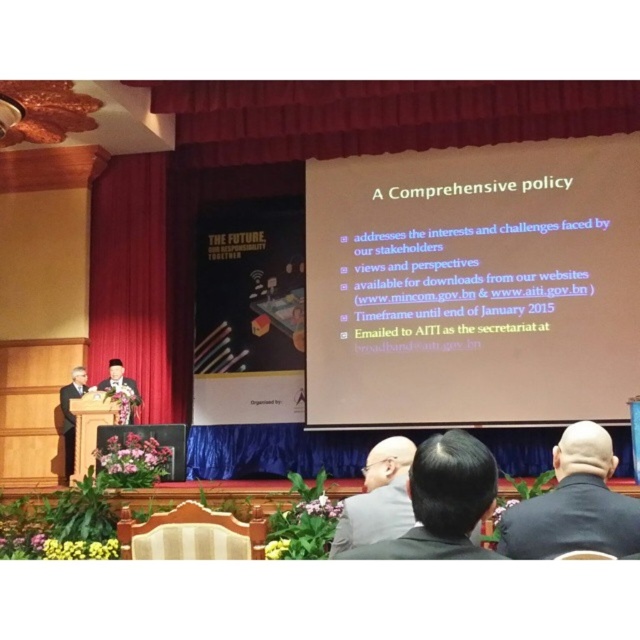
Is red velvet curtain at left closer to camera compared to matte black suit at left?

No, red velvet curtain at left is behind matte black suit at left.

Can you confirm if red velvet curtain at left is positioned above matte black suit at left?

Correct, red velvet curtain at left is located above matte black suit at left.

Find the location of a particular element. This screenshot has width=640, height=640. red velvet curtain at left is located at coordinates (132, 276).

Does red velvet curtain at left appear on the right side of matte black suit at center?

No, red velvet curtain at left is not to the right of matte black suit at center.

Where is `red velvet curtain at left`? The image size is (640, 640). red velvet curtain at left is located at coordinates (132, 276).

Which is more to the right, dark gray suit at center or matte black suit at center?

Positioned to the right is dark gray suit at center.

Can you confirm if dark gray suit at center is taller than matte black suit at center?

No, dark gray suit at center is not taller than matte black suit at center.

Who is more forward, (380, 460) or (129, 394)?

Point (380, 460) is in front.

Locate an element on the screen. dark gray suit at center is located at coordinates tap(378, 499).